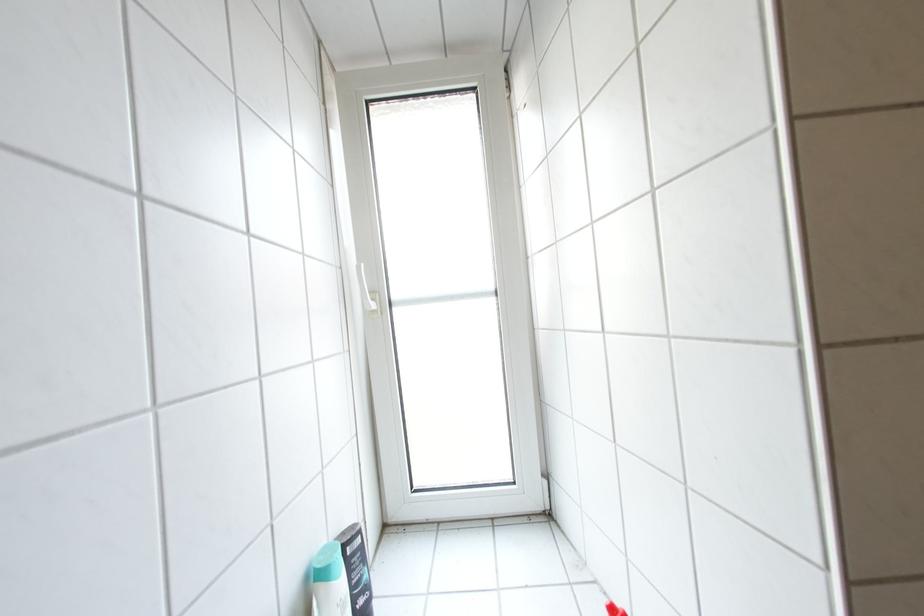
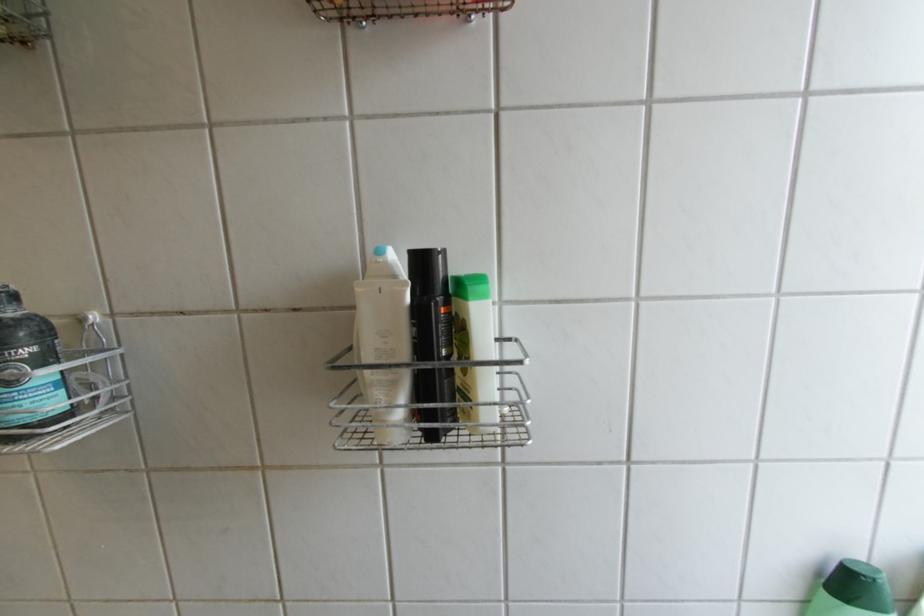
Question: The camera is either moving clockwise (left) or counter-clockwise (right) around the object. The first image is from the beginning of the video and the second image is from the end. Is the camera moving left or right when shooting the video?

Choices:
 (A) Left
 (B) Right

Answer: (B)